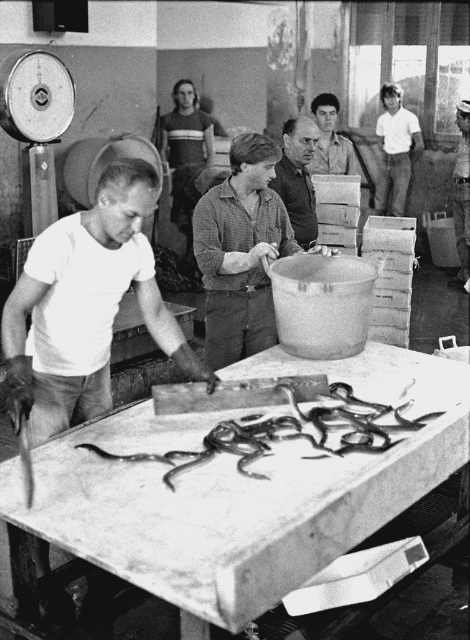
Question: Based on their relative distances, which object is farther from the white matte shirt at left?

Choices:
 (A) matte brown shirt at center
 (B) shiny black snake at center
 (C) white matte shirt at upper right

Answer: (C)

Question: Which object is positioned farthest from the matte brown shirt at center?

Choices:
 (A) white matte shirt at upper right
 (B) shiny black snake at center
 (C) smooth brown shirt at center
 (D) smooth leather jacket at upper right

Answer: (A)

Question: Is smooth white table at center to the right of smooth brown shirt at center from the viewer's perspective?

Choices:
 (A) yes
 (B) no

Answer: (B)

Question: Does white matte shirt at left appear over smooth gray shirt at center?

Choices:
 (A) yes
 (B) no

Answer: (B)

Question: Which of the following is the farthest from the observer?

Choices:
 (A) (397, 173)
 (B) (86, 292)
 (C) (343, 156)

Answer: (A)

Question: Does matte brown shirt at center have a smaller size compared to smooth gray shirt at center?

Choices:
 (A) yes
 (B) no

Answer: (B)